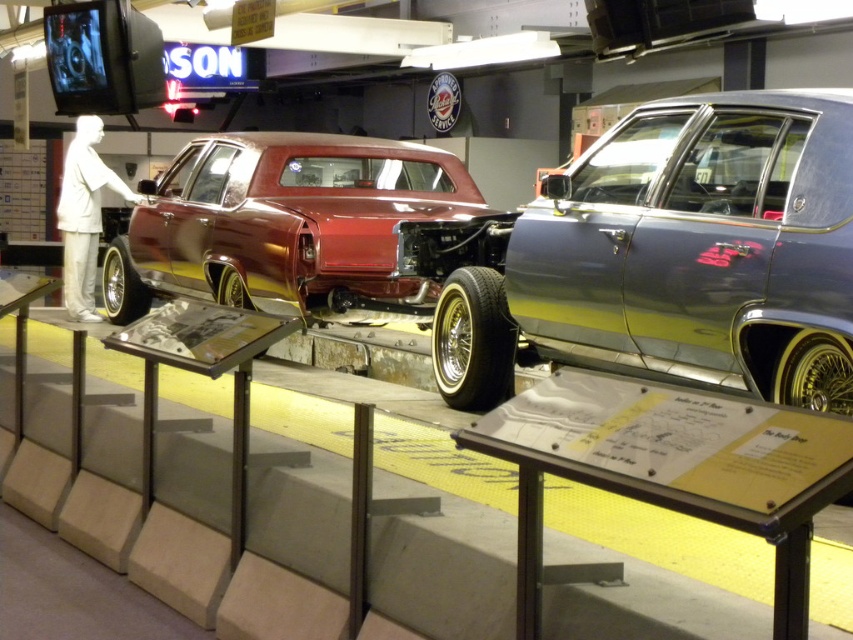
Question: Which of the following is the closest to the observer?

Choices:
 (A) shiny maroon body at center
 (B) white matte suit at left
 (C) metallic silver car at right

Answer: (C)

Question: Which of the following is the closest to the observer?

Choices:
 (A) (165, 188)
 (B) (96, 172)
 (C) (830, 316)

Answer: (C)

Question: Considering the relative positions of shiny maroon body at center and white matte suit at left in the image provided, where is shiny maroon body at center located with respect to white matte suit at left?

Choices:
 (A) left
 (B) right

Answer: (B)

Question: Observing the image, what is the correct spatial positioning of shiny maroon body at center in reference to white matte suit at left?

Choices:
 (A) left
 (B) right

Answer: (B)

Question: Does metallic silver car at right appear on the right side of white matte suit at left?

Choices:
 (A) no
 (B) yes

Answer: (B)

Question: Which of the following is the farthest from the observer?

Choices:
 (A) (83, 301)
 (B) (218, 221)
 (C) (776, 179)

Answer: (A)